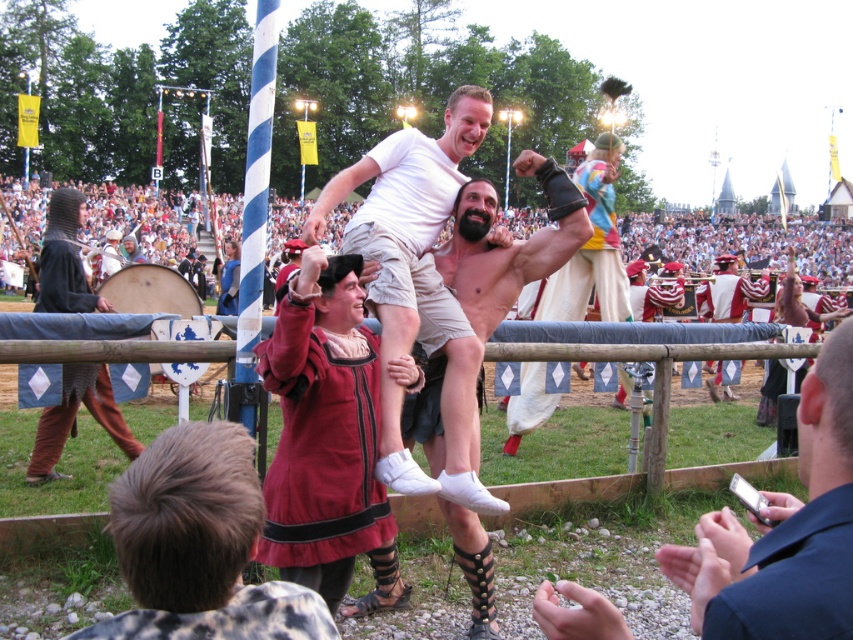
Question: Can you confirm if shiny metallic helmet at center is wider than dark red velvet robe at lower right?

Choices:
 (A) no
 (B) yes

Answer: (B)

Question: Does dark brown leather boots at lower center have a greater width compared to dark red velvet robe at lower right?

Choices:
 (A) no
 (B) yes

Answer: (B)

Question: Among these points, which one is nearest to the camera?

Choices:
 (A) (170, 637)
 (B) (468, 480)
 (C) (55, 266)
 (D) (810, 630)

Answer: (D)

Question: Among these points, which one is nearest to the camera?

Choices:
 (A) (447, 324)
 (B) (711, 300)
 (C) (821, 493)
 (D) (55, 477)

Answer: (C)

Question: Is shiny metallic helmet at center smaller than white cotton t-shirt at center?

Choices:
 (A) yes
 (B) no

Answer: (A)

Question: Which of these objects is positioned closest to the chainmail armor at left?

Choices:
 (A) dark brown leather boots at lower center
 (B) white cotton t-shirt at center
 (C) shiny silver armor at center
 (D) dark red velvet robe at lower right

Answer: (B)